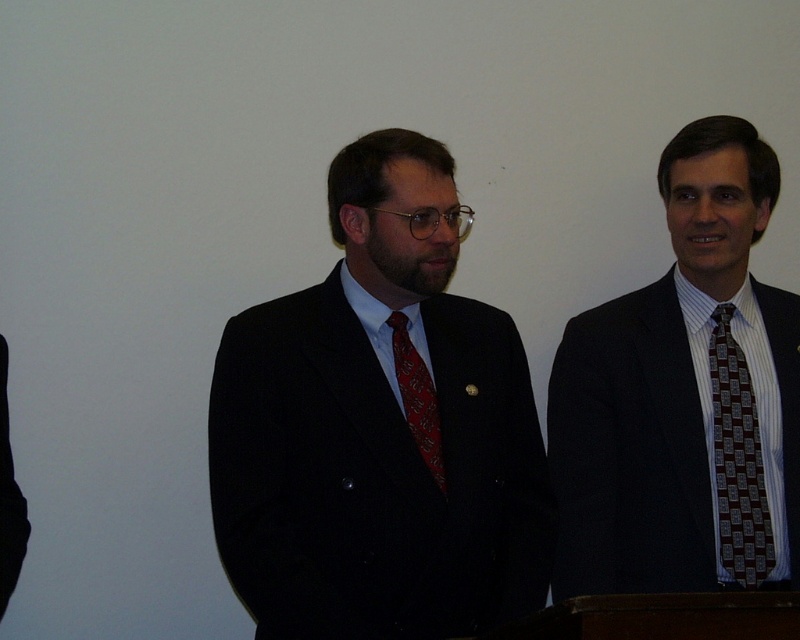
You are a photographer setting up for a group photo. You need to ensure that the matte black suit at center and the brown patterned tie at right are both in focus. The camera you are using has a depth of field that can cover objects within a 25 inch range. Can both subjects be in focus simultaneously?

The matte black suit at center is 25.80 inches away from the brown patterned tie at right. Since the distance between them exceeds the camera sensor depth of field range of 25 inches, both subjects cannot be in focus at the same time.

You are a photographer adjusting the lighting for a group photo. You notice the red silk tie at center and the striped cotton shirt at right. Which object is closer to the camera?

The striped cotton shirt at right is closer to the camera because the red silk tie at center is behind it.